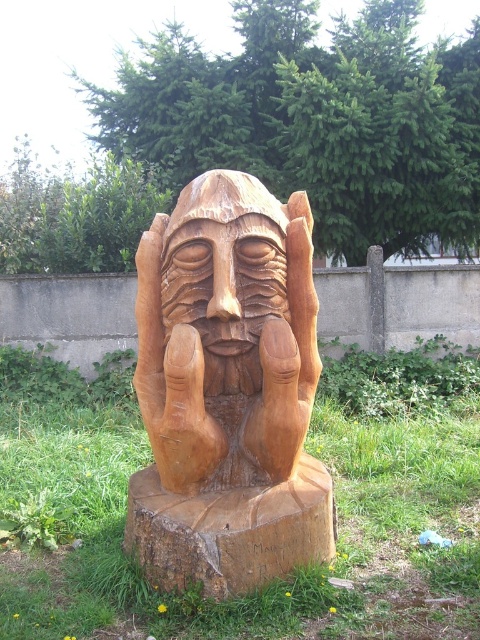
Which is more to the left, green grass at center or wooden carved face at center?

green grass at center

Measure the distance between point (x=342, y=419) and camera.

Point (x=342, y=419) is 5.50 meters away from camera.

What do you see at coordinates (308, 449) in the screenshot? I see `green grass at center` at bounding box center [308, 449].

Where is `green grass at center`? green grass at center is located at coordinates (x=308, y=449).

Locate an element on the screen. This screenshot has width=480, height=640. green grass at center is located at coordinates (308, 449).

This screenshot has height=640, width=480. What do you see at coordinates (308, 449) in the screenshot?
I see `green grass at center` at bounding box center [308, 449].

Find the location of `green grass at center`. green grass at center is located at coordinates (308, 449).

Can you confirm if natural wood carving at center is positioned above wooden carved face at center?

Incorrect, natural wood carving at center is not positioned above wooden carved face at center.

Which is more to the left, natural wood carving at center or wooden carved face at center?

Positioned to the left is wooden carved face at center.

What do you see at coordinates (228, 390) in the screenshot? I see `natural wood carving at center` at bounding box center [228, 390].

Where is `natural wood carving at center`? This screenshot has height=640, width=480. natural wood carving at center is located at coordinates (228, 390).